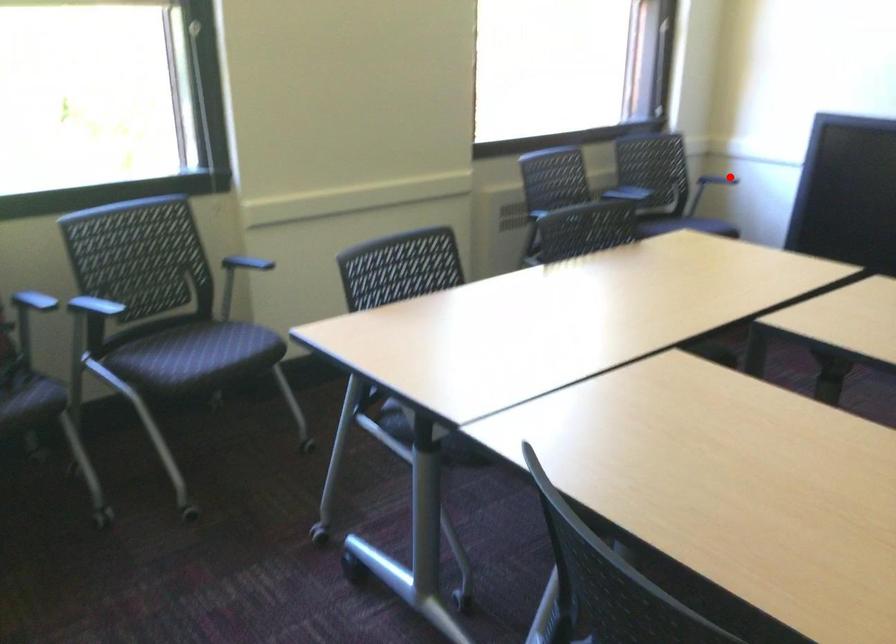
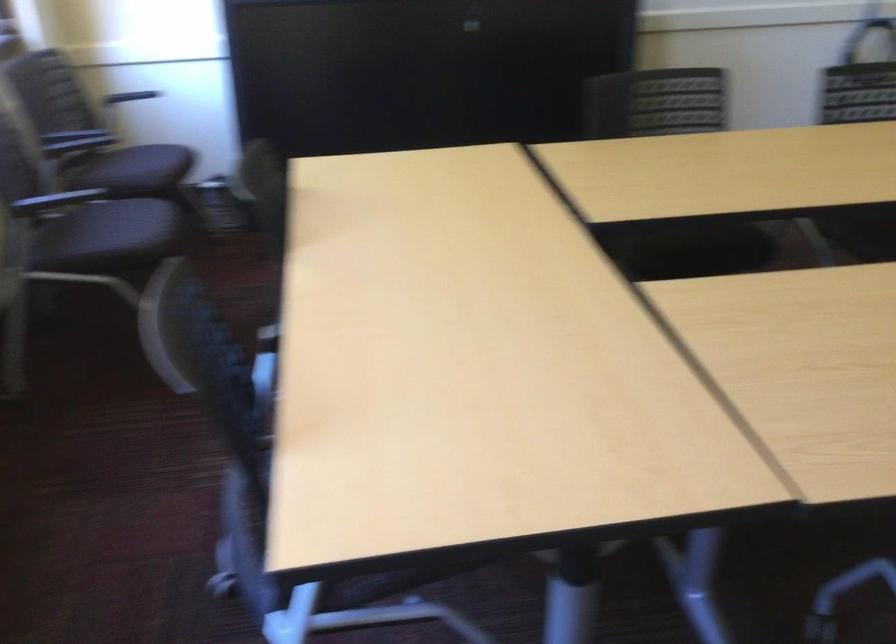
The point at the highlighted location is marked in the first image. Where is the corresponding point in the second image?

(131, 96)